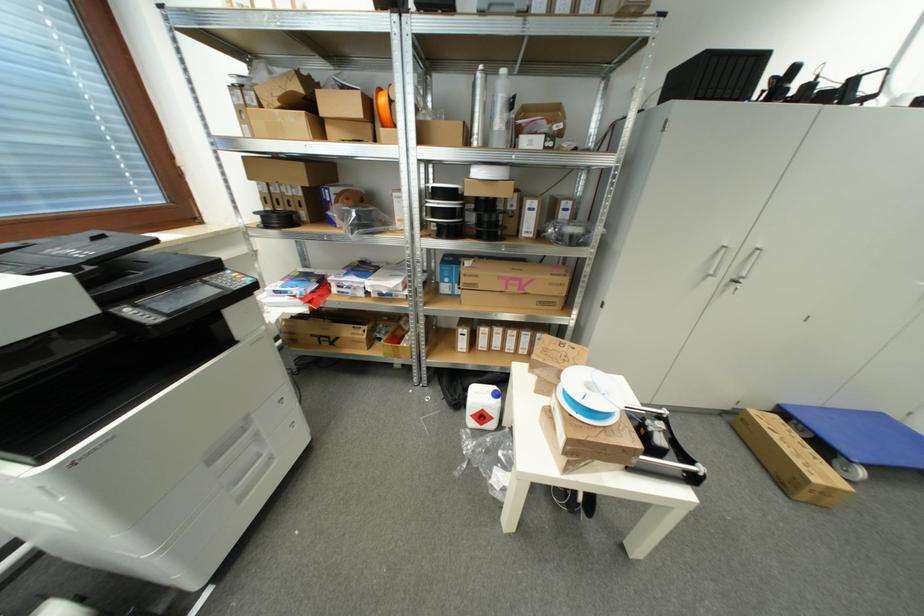
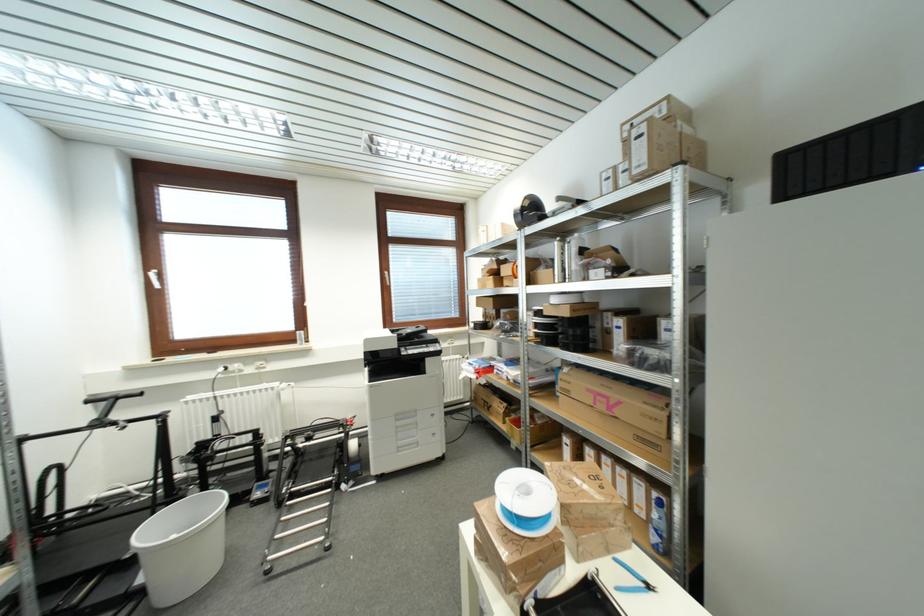
The point at (532, 339) is marked in the first image. Where is the corresponding point in the second image?

(648, 493)